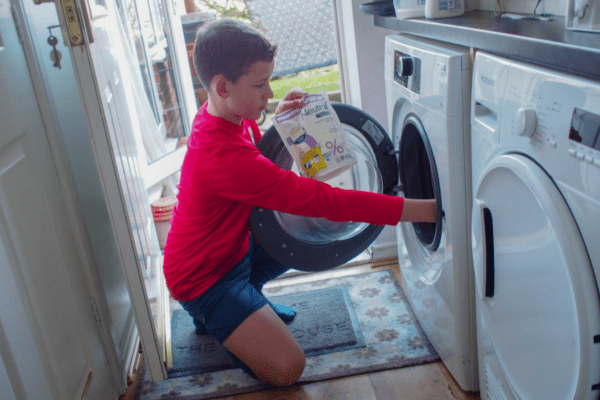
Where is `laundry room`? The width and height of the screenshot is (600, 400). laundry room is located at coordinates (328, 26).